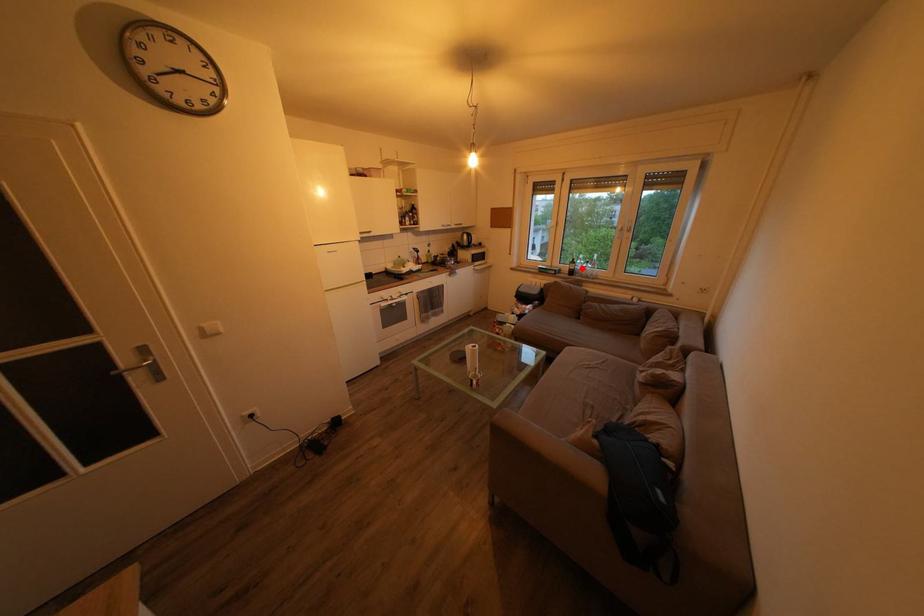
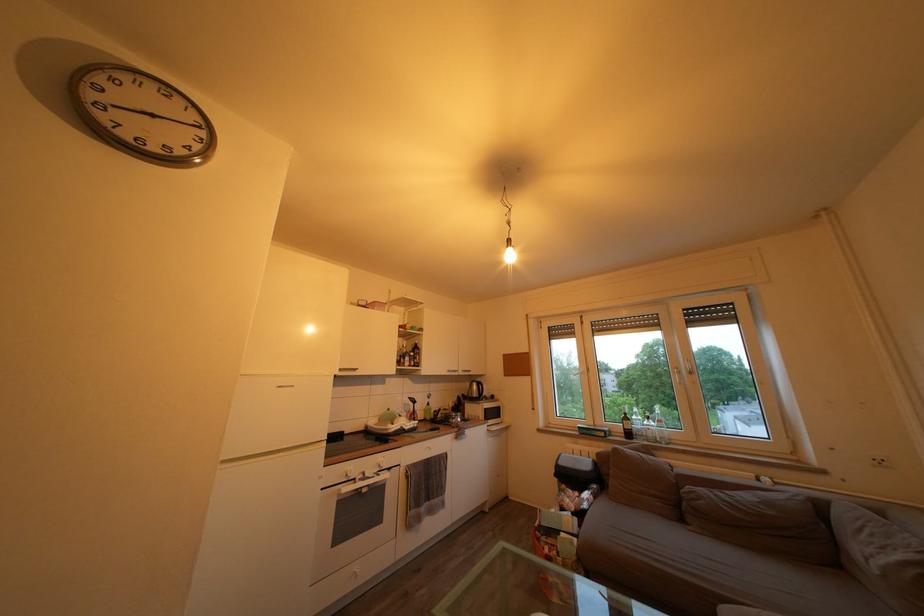
Locate, in the second image, the point that corresponds to the highlighted location in the first image.

(635, 424)